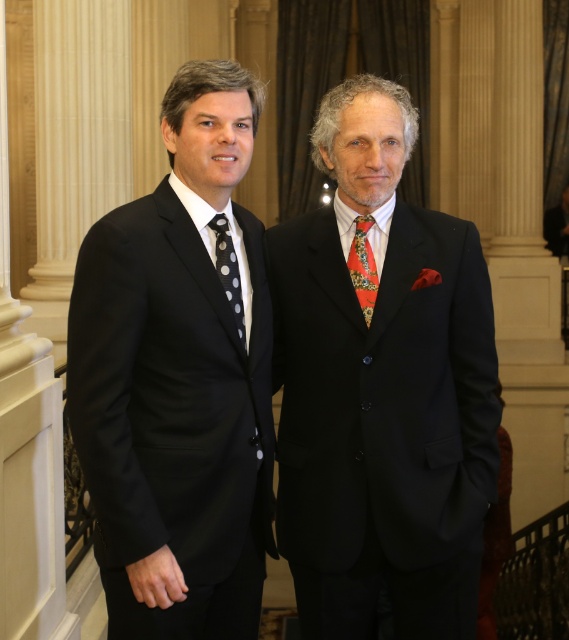
You are a photographer at a formal event and need to adjust the lighting to highlight both ties. Since the multicolored patterned tie at center and the black dotted fabric tie at left are positioned differently, which tie is located to the right of the other?

The multicolored patterned tie at center is to the right of the black dotted fabric tie at left.

You are standing at the entrance of the grand hall and see two points marked in the image. The first point is at coordinates point (162, 300) and the second is at point (356, 218). Which point is closer to you?

Point (162, 300) is in front of point (356, 218), so it is closer to you.